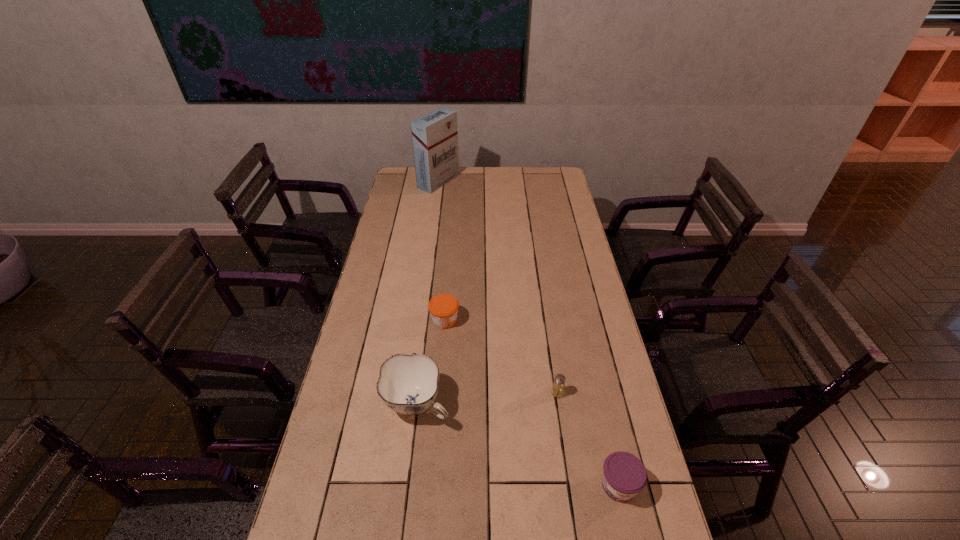
You are a GUI agent. You are given a task and a screenshot of the screen. Output one action in this format:
    pyautogui.click(x=<x>, y=<y>)
    Task: Click on the blank region between the nearest object and the farther jam
    The image size is (960, 540).
    Given the screenshot: What is the action you would take?
    pyautogui.click(x=532, y=403)

Where is `free area in between the fourth nearest object and the tallest object`? The height and width of the screenshot is (540, 960). free area in between the fourth nearest object and the tallest object is located at coordinates (442, 251).

This screenshot has height=540, width=960. Find the location of `vacant point located between the right jam and the second tallest object`. vacant point located between the right jam and the second tallest object is located at coordinates click(518, 445).

The image size is (960, 540). I want to click on vacant space that's between the cigarette case and the saltshaker, so click(x=498, y=287).

Image resolution: width=960 pixels, height=540 pixels. In order to click on blank region between the fourth object from left to right and the nearer jam in this screenshot , I will do `click(588, 439)`.

Image resolution: width=960 pixels, height=540 pixels. Identify the location of free space that is in between the nearest object and the tallest object. (529, 334).

Identify the location of vacant space in between the chinaware and the saltshaker. The height and width of the screenshot is (540, 960). (488, 399).

The image size is (960, 540). Identify the location of object identified as the third closest to the chinaware. (624, 475).

Identify which object is located as the fourth nearest to the second tallest object. Please provide its 2D coordinates. Your answer should be formatted as a tuple, i.e. [(x, y)], where the tuple contains the x and y coordinates of a point satisfying the conditions above.

[(435, 135)]

Find the location of a particular element. jam that is the second closest to the fourth object from left to right is located at coordinates (443, 308).